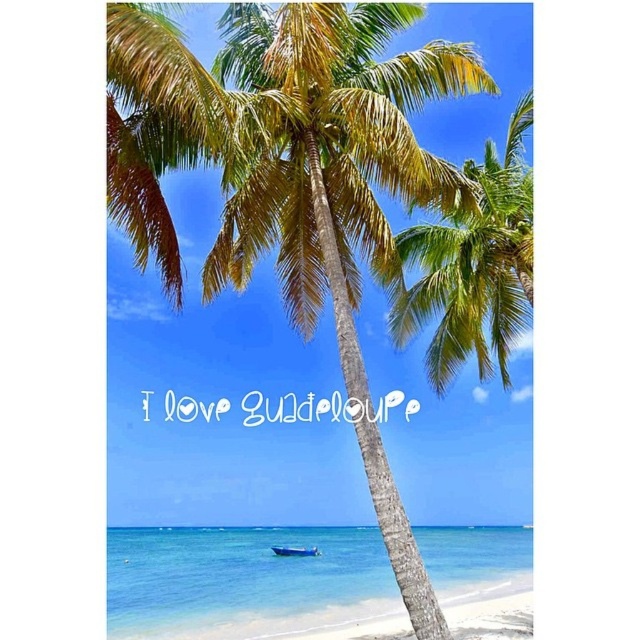
You are standing on the beach looking at the palm tree and the blue boat. If you walk straight towards the point marked at coordinate (310, 506), how far will you have to walk to reach it?

The point marked at coordinate (310, 506) is 25.36 meters away from the viewer, so you will have to walk 25.36 meters to reach it.

You are a photographer standing on the beach and want to capture both the green leafy coconut tree at center and the blue plastic boat at lower center in your shot. Which object will appear taller in your photo?

The green leafy coconut tree at center will appear taller in the photo since it has a greater height compared to the blue plastic boat at lower center.

You are standing on the beach and want to walk from the blue plastic boat at lower center to the green leafy coconut tree at center. Which direction should you face to walk directly towards the tree?

You should face to the right to walk directly towards the green leafy coconut tree at center because it is located to the right of the blue plastic boat at lower center.